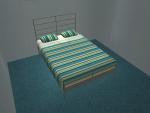
Image resolution: width=150 pixels, height=113 pixels. Identify the location of right of bed. (108, 50).